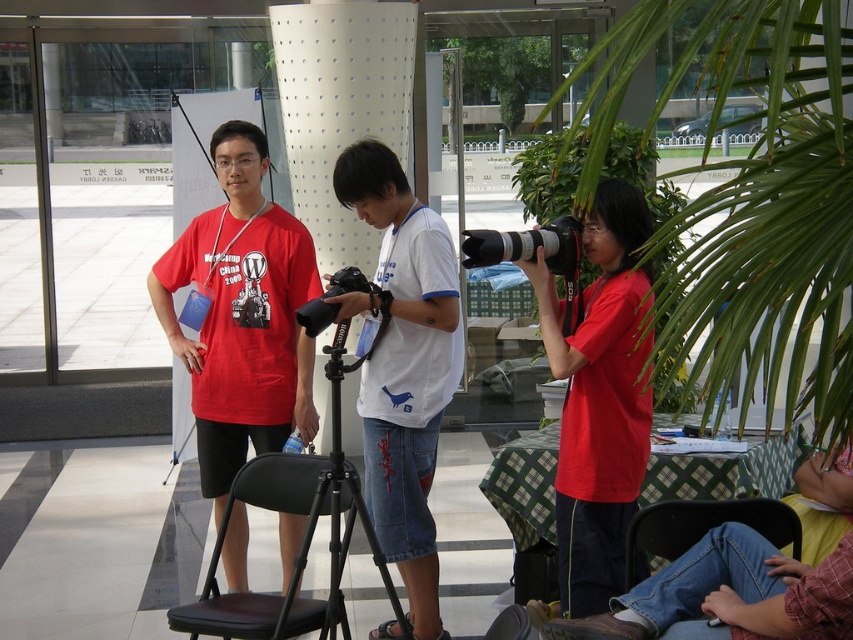
Is matte red t-shirt at left below matte red shirt at center?

No.

Does point (300, 339) come behind point (582, 371)?

Yes, point (300, 339) is farther from viewer.

Which is in front, point (167, 256) or point (614, 196)?

Point (614, 196)

Find the location of `matte red t-shirt at left`. matte red t-shirt at left is located at coordinates pos(241,316).

Is point (612, 554) farther from viewer compared to point (358, 276)?

No, (612, 554) is closer to viewer.

From the picture: Between matte red shirt at center and black rubber camera at center, which one has more height?

With more height is matte red shirt at center.

You are a GUI agent. You are given a task and a screenshot of the screen. Output one action in this format:
    pyautogui.click(x=<x>, y=<y>)
    Task: Click on the matte red shirt at center
    
    Given the screenshot: What is the action you would take?
    pyautogui.click(x=599, y=397)

I want to click on matte red shirt at center, so click(599, 397).

Locate an element on the screen. Image resolution: width=853 pixels, height=640 pixels. white cotton t-shirt at center is located at coordinates (403, 365).

Between white cotton t-shirt at center and black rubber camera at center, which one has less height?

Standing shorter between the two is black rubber camera at center.

Who is more distant from viewer, (392,499) or (346,288)?

Point (392,499)

This screenshot has height=640, width=853. I want to click on white cotton t-shirt at center, so click(403, 365).